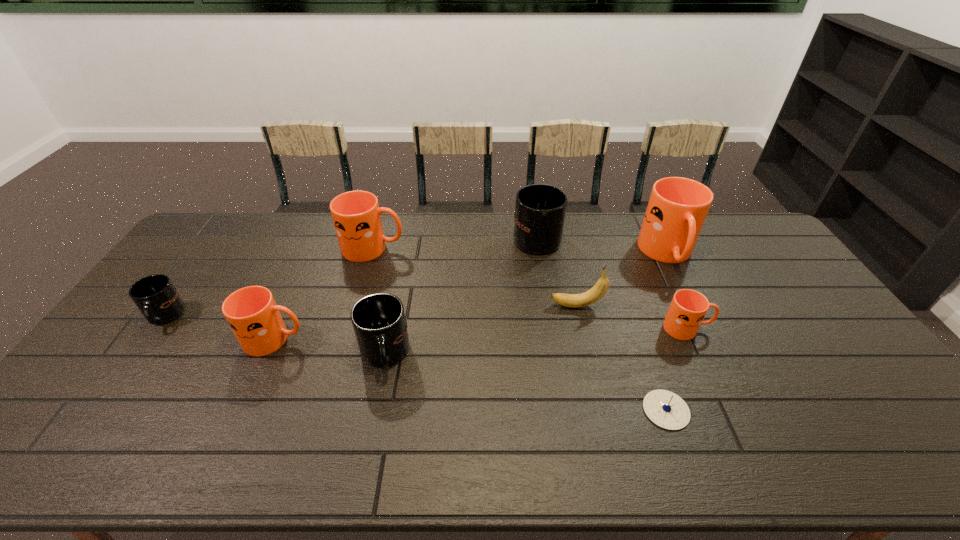
The image size is (960, 540). What are the coordinates of `the smallest black mug` in the screenshot? It's located at (155, 296).

This screenshot has height=540, width=960. Find the location of `the leftmost black mug`. the leftmost black mug is located at coordinates (155, 296).

Image resolution: width=960 pixels, height=540 pixels. What are the coordinates of `the third object from right to left` in the screenshot? It's located at [664, 408].

The image size is (960, 540). Find the location of `blue compass`. blue compass is located at coordinates (664, 408).

Where is `vacant space positioned on the handle side of the tallest mug`? vacant space positioned on the handle side of the tallest mug is located at coordinates (714, 348).

I want to click on free spot located on the handle side of the second orange mug from left to right, so click(x=444, y=248).

You are a GUI agent. You are given a task and a screenshot of the screen. Output one action in this format:
    pyautogui.click(x=<x>, y=<y>)
    Task: Click on the vacant region located at the start of the peel on the yellow banana
    The height and width of the screenshot is (540, 960).
    Given the screenshot: What is the action you would take?
    pyautogui.click(x=452, y=306)

The image size is (960, 540). In order to click on blank space located at the start of the peel on the yellow banana in this screenshot , I will do `click(462, 306)`.

Locate an element on the screen. This screenshot has height=540, width=960. free region located 0.270m at the start of the peel on the yellow banana is located at coordinates (462, 306).

You are a GUI agent. You are given a task and a screenshot of the screen. Output one action in this format:
    pyautogui.click(x=<x>, y=<y>)
    Task: Click on the free space located on the handle side of the leftmost orange mug
    The width and height of the screenshot is (960, 540).
    Given the screenshot: What is the action you would take?
    pyautogui.click(x=426, y=340)